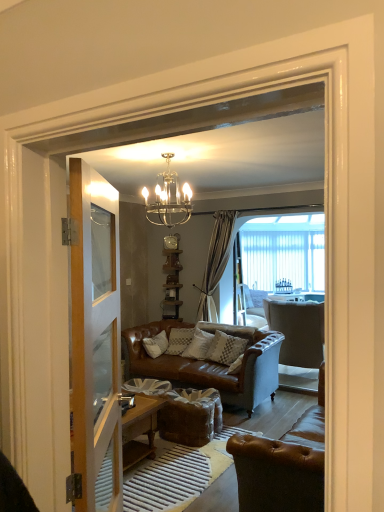
What do you see at coordinates (226, 348) in the screenshot? I see `textured beige pillow at center` at bounding box center [226, 348].

The width and height of the screenshot is (384, 512). Identify the location of light gray fabric armchair at center, the 1th chair positioned from the back. (298, 331).

What do you see at coordinates (298, 331) in the screenshot? This screenshot has height=512, width=384. I see `light gray fabric armchair at center, which appears as the second chair when viewed from the front` at bounding box center [298, 331].

At what (x,y) coordinates should I click in order to perform the action: click on clear glass door at left. Please return your answer as a coordinate pair (x, y). This screenshot has width=384, height=512. Looking at the image, I should click on (95, 338).

The image size is (384, 512). What do you see at coordinates (95, 338) in the screenshot?
I see `clear glass door at left` at bounding box center [95, 338].

At what (x,y) coordinates should I click in order to perform the action: click on clear glass chandelier at upper center. Please return your answer as a coordinate pair (x, y). Looking at the image, I should click on click(x=168, y=199).

Based on the photo, measure the distance between point (x=177, y=241) and camera.

A distance of 22.60 feet exists between point (x=177, y=241) and camera.

What are the coordinates of `metallic silver clock at upper center` in the screenshot? It's located at (171, 242).

Locate an element on the screen. This screenshot has width=384, height=512. brown leather chair at lower right, which appears as the 2th chair when viewed from the back is located at coordinates pyautogui.click(x=284, y=464).

From a real-world perspective, is metallic silver clock at upper center positioned over clear glass door at left based on gravity?

Yes.

Would you say metallic silver clock at upper center is inside or outside clear glass door at left?

metallic silver clock at upper center is located beyond the bounds of clear glass door at left.

Between point (172, 240) and point (100, 317), which one is positioned behind?

Point (172, 240)

The width and height of the screenshot is (384, 512). I want to click on clock above the clear glass door at left (from the image's perspective), so click(x=171, y=242).

Is textured beige pillow at center situated inside light gray fabric armchair at center, the 1th chair positioned from the back, or outside?

textured beige pillow at center lies outside light gray fabric armchair at center, the 1th chair positioned from the back.

Considering the sizes of objects textured beige pillow at center and light gray fabric armchair at center, which appears as the second chair when viewed from the front, in the image provided, who is thinner, textured beige pillow at center or light gray fabric armchair at center, which appears as the second chair when viewed from the front,?

Thinner between the two is textured beige pillow at center.

Between textured beige pillow at center and light gray fabric armchair at center, which appears as the second chair when viewed from the front, which one has more height?

light gray fabric armchair at center, which appears as the second chair when viewed from the front, is taller.

Visually, is clear glass door at left positioned to the left or to the right of metallic silver clock at upper center?

clear glass door at left is positioned on metallic silver clock at upper center's left side.

Which of these two, clear glass door at left or metallic silver clock at upper center, stands taller?

With more height is clear glass door at left.

From a real-world perspective, between clear glass door at left and metallic silver clock at upper center, who is vertically higher?

In real-world perspective, metallic silver clock at upper center is above.

Is point (72, 194) positioned before point (175, 237)?

Yes.

From the picture: Between textured beige pillow at center and clear glass chandelier at upper center, which one has larger width?

clear glass chandelier at upper center is wider.

Does textured beige pillow at center lie in front of clear glass chandelier at upper center?

No, textured beige pillow at center is behind clear glass chandelier at upper center.

Is textured beige pillow at center aimed at clear glass chandelier at upper center?

No, textured beige pillow at center does not turn towards clear glass chandelier at upper center.

Is textured beige pillow at center shorter than clear glass chandelier at upper center?

Indeed, textured beige pillow at center has a lesser height compared to clear glass chandelier at upper center.

Is clear glass chandelier at upper center inside metallic silver clock at upper center?

No, metallic silver clock at upper center does not contain clear glass chandelier at upper center.

Looking at this image, from a real-world perspective, which is physically below, metallic silver clock at upper center or clear glass chandelier at upper center?

From a 3D spatial view, metallic silver clock at upper center is below.

Which of these two, metallic silver clock at upper center or clear glass chandelier at upper center, is wider?

clear glass chandelier at upper center is wider.

Is metallic silver clock at upper center behind clear glass chandelier at upper center?

That is True.

Does clear glass chandelier at upper center lie in front of light gray fabric armchair at center, which appears as the second chair when viewed from the front?

Yes, clear glass chandelier at upper center is in front of light gray fabric armchair at center, which appears as the second chair when viewed from the front.

Between clear glass chandelier at upper center and light gray fabric armchair at center, the 1th chair positioned from the back, which one has larger width?

Wider between the two is light gray fabric armchair at center, the 1th chair positioned from the back.

Between clear glass chandelier at upper center and light gray fabric armchair at center, the 1th chair positioned from the back, which one has more height?

light gray fabric armchair at center, the 1th chair positioned from the back, is taller.

Considering the points (182, 191) and (308, 312), which point is in front, point (182, 191) or point (308, 312)?

Point (182, 191)

From the image's perspective, between textured beige pillow at center and brown leather chair at lower right, which appears as the 2th chair when viewed from the back, who is located below?

brown leather chair at lower right, which appears as the 2th chair when viewed from the back.

Who is shorter, textured beige pillow at center or brown leather chair at lower right, which is the 1th chair in front-to-back order?

Standing shorter between the two is textured beige pillow at center.

From a real-world perspective, is textured beige pillow at center positioned above or below brown leather chair at lower right, which appears as the 2th chair when viewed from the back?

textured beige pillow at center is above brown leather chair at lower right, which appears as the 2th chair when viewed from the back.

This screenshot has width=384, height=512. Find the location of `door located in front of the metallic silver clock at upper center`. door located in front of the metallic silver clock at upper center is located at coordinates (95, 338).

You are a GUI agent. You are given a task and a screenshot of the screen. Output one action in this format:
    pyautogui.click(x=<x>, y=<y>)
    Task: Click on the pillow to the left of light gray fabric armchair at center, which appears as the second chair when viewed from the front
    
    Given the screenshot: What is the action you would take?
    pyautogui.click(x=226, y=348)

Which object lies further to the anchor point brown leather chair at lower right, which appears as the 2th chair when viewed from the back, clear glass chandelier at upper center or light gray fabric armchair at center, the 1th chair positioned from the back?

light gray fabric armchair at center, the 1th chair positioned from the back, is further to brown leather chair at lower right, which appears as the 2th chair when viewed from the back.

Looking at the image, which one is located closer to brown leather chair at lower right, which appears as the 2th chair when viewed from the back, light gray fabric armchair at center, the 1th chair positioned from the back, or clear glass chandelier at upper center?

clear glass chandelier at upper center.

Estimate the real-world distances between objects in this image. Which object is closer to textured beige pillow at center, brown leather chair at lower right, which appears as the 2th chair when viewed from the back, or clear glass door at left?

Among the two, brown leather chair at lower right, which appears as the 2th chair when viewed from the back, is located nearer to textured beige pillow at center.

Based on their spatial positions, is textured beige pillow at center or metallic silver clock at upper center further from clear glass chandelier at upper center?

The object further to clear glass chandelier at upper center is metallic silver clock at upper center.

Which object lies further to the anchor point clear glass door at left, textured beige pillow at center or light gray fabric armchair at center, which appears as the second chair when viewed from the front?

light gray fabric armchair at center, which appears as the second chair when viewed from the front.

Looking at the image, which one is located closer to metallic silver clock at upper center, textured beige pillow at center or brown leather chair at lower right, which is the 1th chair in front-to-back order?

textured beige pillow at center.

From the image, which object appears to be farther from clear glass chandelier at upper center, metallic silver clock at upper center or textured beige pillow at center?

Among the two, metallic silver clock at upper center is located further to clear glass chandelier at upper center.

From the image, which object appears to be nearer to brown leather chair at lower right, which appears as the 2th chair when viewed from the back, light gray fabric armchair at center, which appears as the second chair when viewed from the front, or textured beige pillow at center?

textured beige pillow at center lies closer to brown leather chair at lower right, which appears as the 2th chair when viewed from the back, than the other object.

Where is `chair between clear glass door at left and textured beige pillow at center along the z-axis`? This screenshot has height=512, width=384. chair between clear glass door at left and textured beige pillow at center along the z-axis is located at coordinates (284, 464).

Identify the location of lamp located between brown leather chair at lower right, which appears as the 2th chair when viewed from the back, and textured beige pillow at center in the depth direction. (x=168, y=199).

You are a GUI agent. You are given a task and a screenshot of the screen. Output one action in this format:
    pyautogui.click(x=<x>, y=<y>)
    Task: Click on the lamp positioned between clear glass door at left and light gray fabric armchair at center, the 1th chair positioned from the back, from near to far
    
    Given the screenshot: What is the action you would take?
    pyautogui.click(x=168, y=199)

Locate an element on the screen. The image size is (384, 512). pillow located between brown leather chair at lower right, which is the 1th chair in front-to-back order, and metallic silver clock at upper center in the depth direction is located at coordinates click(x=226, y=348).